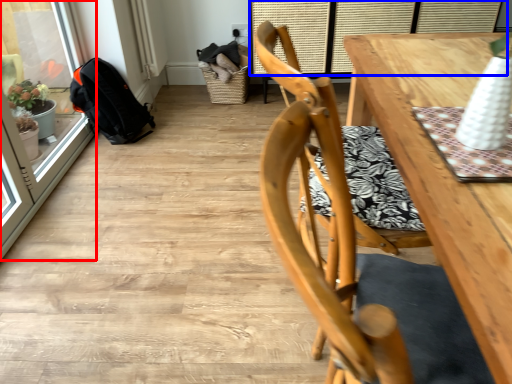
Question: Which object is closer to the camera taking this photo, screen door (highlighted by a red box) or window (highlighted by a blue box)?

Choices:
 (A) screen door
 (B) window

Answer: (A)